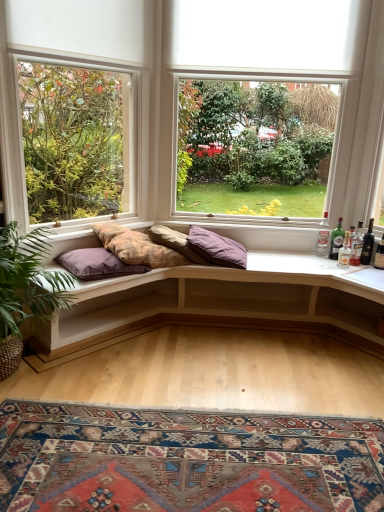
This screenshot has width=384, height=512. I want to click on vacant region below wooden cushioned bench at center (from a real-world perspective), so click(235, 351).